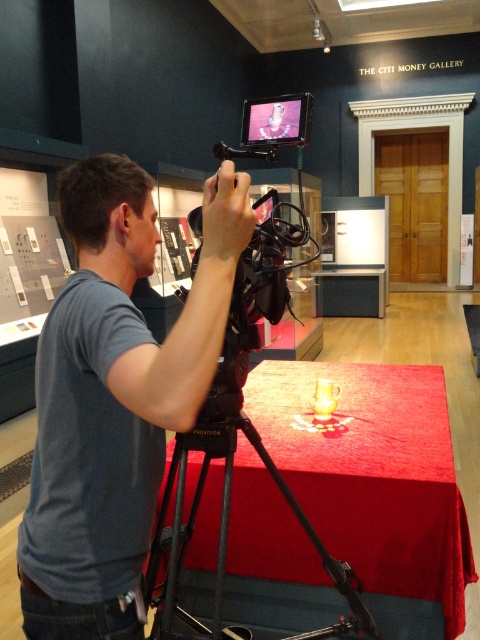
Which of these two, blue cotton shirt at center or shiny red fabric at center, stands shorter?

shiny red fabric at center is shorter.

Between blue cotton shirt at center and shiny red fabric at center, which one is positioned higher?

blue cotton shirt at center is above.

Is point (155, 401) positioned after point (465, 552)?

That is False.

In order to click on blue cotton shirt at center in this screenshot , I will do `click(116, 396)`.